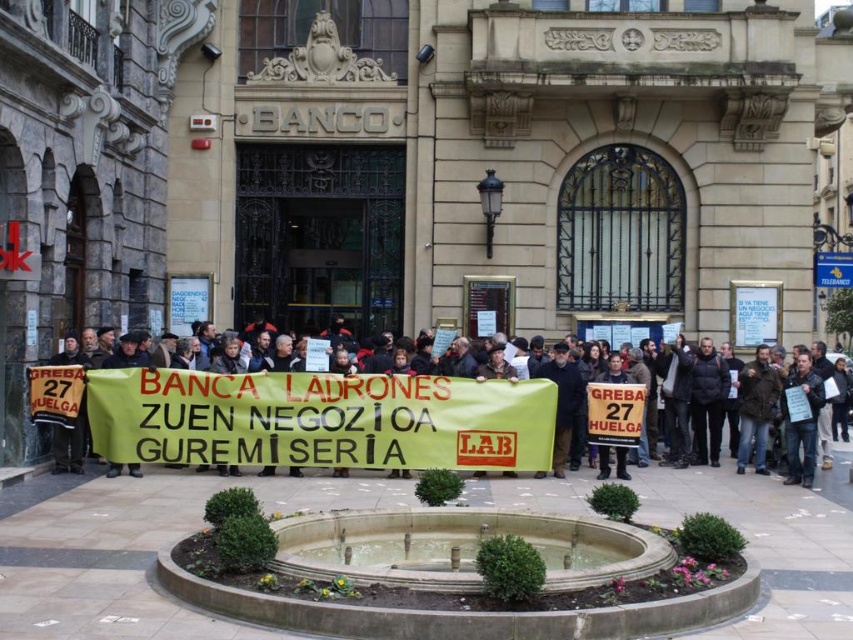
Between dark gray jacket at center and white paper sign at center, which one appears on the right side from the viewer's perspective?

Positioned to the right is white paper sign at center.

Is dark gray jacket at center closer to camera compared to white paper sign at center?

Yes.

Locate an element on the screen. This screenshot has height=640, width=853. dark gray jacket at center is located at coordinates (318, 419).